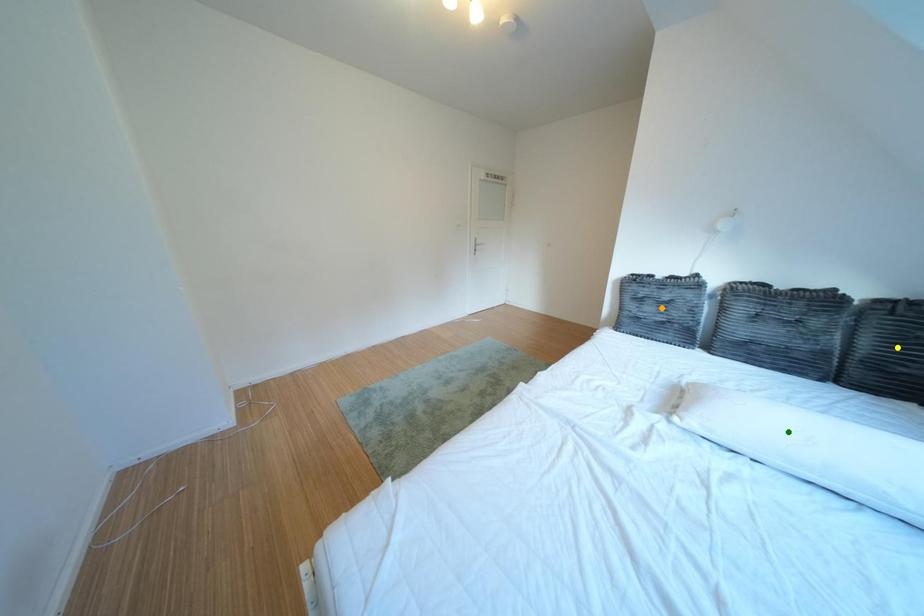
Order these from farthest to nearest:
orange point | green point | yellow point

orange point, green point, yellow point